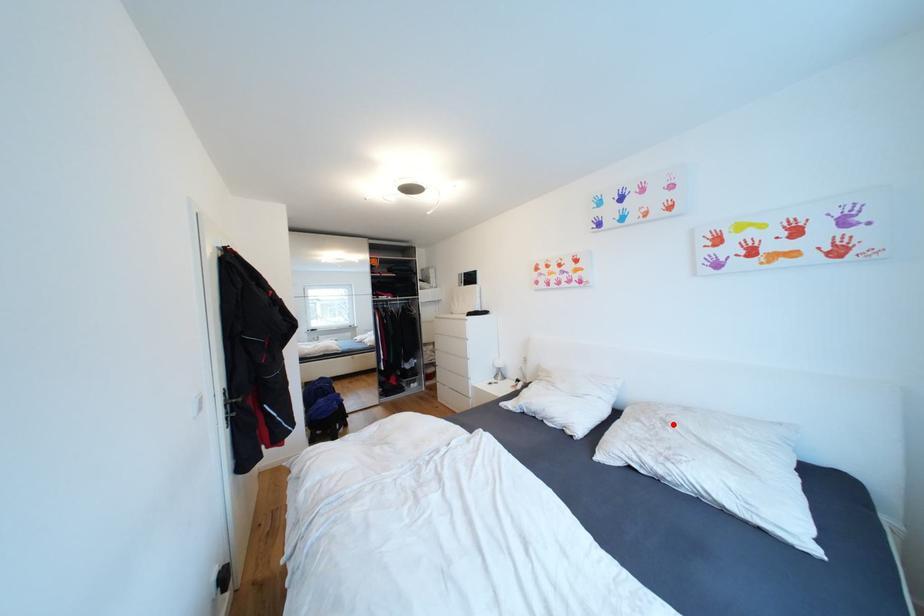
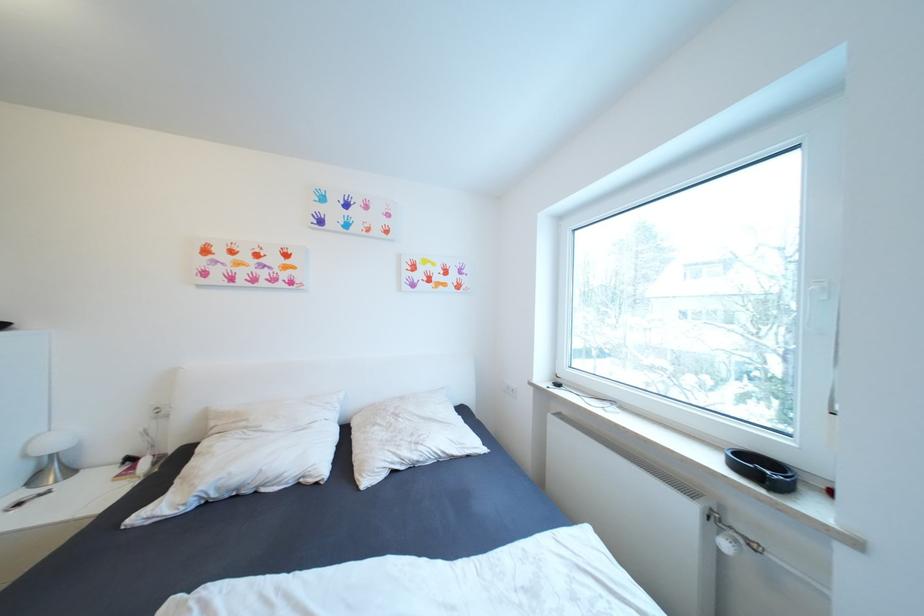
The point at the highlighted location is marked in the first image. Where is the corresponding point in the second image?

(405, 416)